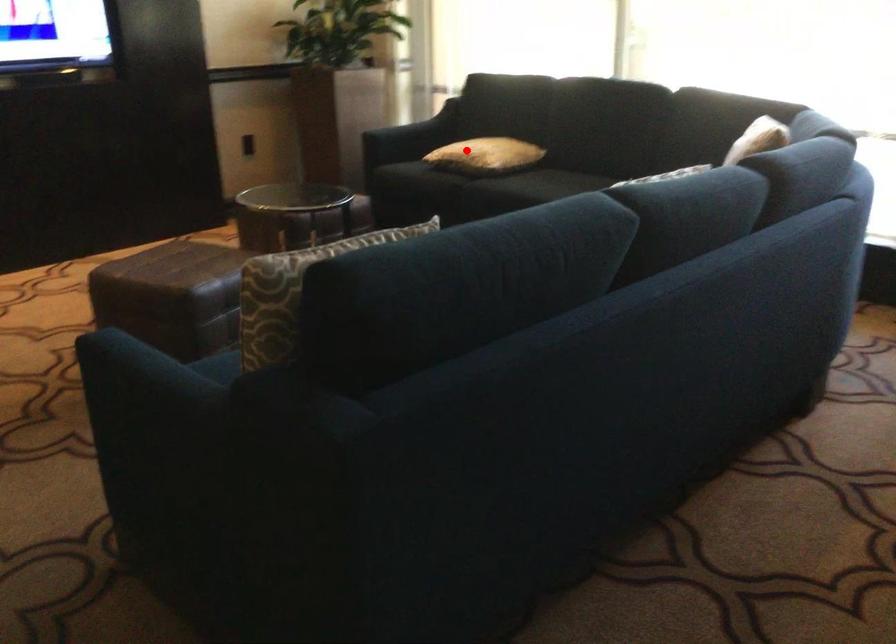
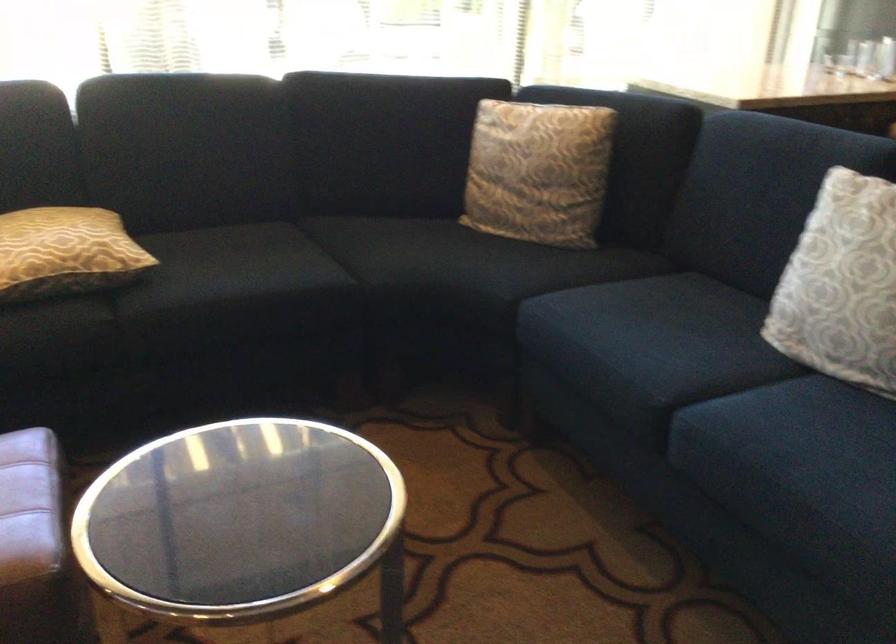
Find the pixel in the second image that matches the highlighted location in the first image.

(65, 252)